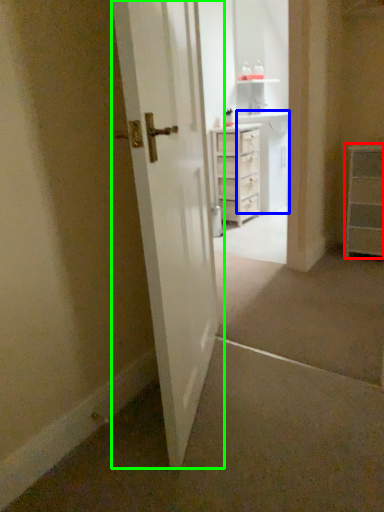
Question: Which object is positioned closest to chest of drawers (highlighted by a red box)? Select from cabinetry (highlighted by a blue box) and door (highlighted by a green box).

Choices:
 (A) cabinetry
 (B) door

Answer: (A)